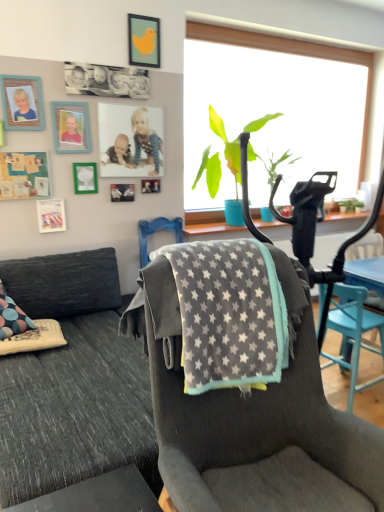
Where is `green leafy plant at center`? The height and width of the screenshot is (512, 384). green leafy plant at center is located at coordinates (227, 146).

Find the location of a particular element. metallic silver picture frame at upper left, which appears as the fifth picture frame when ordered from the bottom is located at coordinates tap(85, 178).

The width and height of the screenshot is (384, 512). What do you see at coordinates (353, 333) in the screenshot?
I see `gray fabric chair at center, arranged as the first chair when viewed from the right` at bounding box center [353, 333].

This screenshot has height=512, width=384. What do you see at coordinates (73, 381) in the screenshot?
I see `velvet gray couch at center` at bounding box center [73, 381].

At what (x,y) coordinates should I click in order to perform the action: click on green leafy plant at center. Please return your answer as a coordinate pair (x, y). This screenshot has height=512, width=384. Looking at the image, I should click on (227, 146).

Considering their positions, is wooden photo frame at upper left, the 8th picture frame when ordered from top to bottom, located in front of or behind gray fleece blanket at center, the first chair when ordered from left to right?

Visually, wooden photo frame at upper left, the 8th picture frame when ordered from top to bottom, is located behind gray fleece blanket at center, the first chair when ordered from left to right.

From a real-world perspective, between wooden photo frame at upper left, which is the 2th picture frame in bottom-to-top order, and gray fleece blanket at center, placed as the 2th chair when sorted from back to front, who is vertically lower?

gray fleece blanket at center, placed as the 2th chair when sorted from back to front.

Is wooden photo frame at upper left, the 8th picture frame when ordered from top to bottom, wider than gray fleece blanket at center, which is the second chair in right-to-left order?

No.

Based on their positions, is wooden photo frame at upper left, the 8th picture frame when ordered from top to bottom, located to the left or right of gray fleece blanket at center, which is the second chair in right-to-left order?

wooden photo frame at upper left, the 8th picture frame when ordered from top to bottom, is to the left of gray fleece blanket at center, which is the second chair in right-to-left order.

Is metallic silver picture frame at upper left, positioned as the 1th picture frame in bottom-to-top order, facing towards metallic silver photo frame at center, which is the sixth picture frame from top to bottom?

No.

Which is nearer, (x=44, y=207) or (x=156, y=192)?

The point (x=44, y=207) is closer to the camera.

From a real-world perspective, is metallic silver picture frame at upper left, acting as the ninth picture frame starting from the top, above or below metallic silver photo frame at center, which is the sixth picture frame from top to bottom?

metallic silver picture frame at upper left, acting as the ninth picture frame starting from the top, is situated lower than metallic silver photo frame at center, which is the sixth picture frame from top to bottom, in the real world.

Which is more to the left, metallic silver picture frame at upper left, positioned as the 1th picture frame in bottom-to-top order, or metallic silver photo frame at center, which is counted as the 4th picture frame, starting from the bottom?

metallic silver picture frame at upper left, positioned as the 1th picture frame in bottom-to-top order.

Which picture frame is the 7th one when counting from the right side of the wooden picture frame at upper left, the seventh picture frame when ordered from top to bottom? Please provide its 2D coordinates.

[(144, 41)]

Considering the relative sizes of wooden picture frame at upper left, the seventh picture frame when ordered from top to bottom, and yellow matte picture frame at upper center, the 9th picture frame when ordered from bottom to top, in the image provided, is wooden picture frame at upper left, the seventh picture frame when ordered from top to bottom, bigger than yellow matte picture frame at upper center, the 9th picture frame when ordered from bottom to top,?

Yes, wooden picture frame at upper left, the seventh picture frame when ordered from top to bottom, is bigger than yellow matte picture frame at upper center, the 9th picture frame when ordered from bottom to top.

How far apart are wooden picture frame at upper left, the seventh picture frame when ordered from top to bottom, and yellow matte picture frame at upper center, the 9th picture frame when ordered from bottom to top?

They are 1.10 meters apart.

Considering their positions, is wooden picture frame at upper left, the seventh picture frame when ordered from top to bottom, located in front of or behind yellow matte picture frame at upper center, arranged as the 1th picture frame when viewed from the top?

wooden picture frame at upper left, the seventh picture frame when ordered from top to bottom, is in front of yellow matte picture frame at upper center, arranged as the 1th picture frame when viewed from the top.

Between green leafy plant at center and teal wooden picture frame at upper left, positioned as the seventh picture frame in bottom-to-top order, which one has smaller size?

teal wooden picture frame at upper left, positioned as the seventh picture frame in bottom-to-top order.

From a real-world perspective, relative to teal wooden picture frame at upper left, positioned as the seventh picture frame in bottom-to-top order, is green leafy plant at center vertically above or below?

green leafy plant at center is below teal wooden picture frame at upper left, positioned as the seventh picture frame in bottom-to-top order.

From the image's perspective, is green leafy plant at center positioned above or below teal wooden picture frame at upper left, positioned as the seventh picture frame in bottom-to-top order?

green leafy plant at center is situated lower than teal wooden picture frame at upper left, positioned as the seventh picture frame in bottom-to-top order, in the image.

In terms of width, does green leafy plant at center look wider or thinner when compared to teal wooden picture frame at upper left, positioned as the seventh picture frame in bottom-to-top order?

Considering their sizes, green leafy plant at center looks broader than teal wooden picture frame at upper left, positioned as the seventh picture frame in bottom-to-top order.

Which is more to the left, velvet gray couch at center or metallic silver picture frame at upper left, marked as the 5th picture frame in a top-to-bottom arrangement?

metallic silver picture frame at upper left, marked as the 5th picture frame in a top-to-bottom arrangement, is more to the left.

Is velvet gray couch at center smaller than metallic silver picture frame at upper left, marked as the 5th picture frame in a top-to-bottom arrangement?

Actually, velvet gray couch at center might be larger than metallic silver picture frame at upper left, marked as the 5th picture frame in a top-to-bottom arrangement.

Which point is more distant from viewer, (108, 353) or (77, 180)?

Positioned behind is point (77, 180).

Considering the relative sizes of metallic silver photo frame at center, which is the sixth picture frame from top to bottom, and green leafy plant at center in the image provided, is metallic silver photo frame at center, which is the sixth picture frame from top to bottom, wider than green leafy plant at center?

No, metallic silver photo frame at center, which is the sixth picture frame from top to bottom, is not wider than green leafy plant at center.

Between point (146, 192) and point (267, 114), which one is positioned behind?

Point (267, 114)

Can you confirm if metallic silver photo frame at center, which is the sixth picture frame from top to bottom, is bigger than green leafy plant at center?

Incorrect, metallic silver photo frame at center, which is the sixth picture frame from top to bottom, is not larger than green leafy plant at center.

How many degrees apart are the facing directions of metallic silver photo frame at center, which is the sixth picture frame from top to bottom, and green leafy plant at center?

The facing directions of metallic silver photo frame at center, which is the sixth picture frame from top to bottom, and green leafy plant at center are 0.626 degrees apart.

From the image's perspective, is yellow matte picture frame at upper center, arranged as the 1th picture frame when viewed from the top, positioned above or below teal wooden picture frame at upper left, positioned as the seventh picture frame in bottom-to-top order?

yellow matte picture frame at upper center, arranged as the 1th picture frame when viewed from the top, is above teal wooden picture frame at upper left, positioned as the seventh picture frame in bottom-to-top order.

Consider the image. In terms of height, does yellow matte picture frame at upper center, arranged as the 1th picture frame when viewed from the top, look taller or shorter compared to teal wooden picture frame at upper left, positioned as the seventh picture frame in bottom-to-top order?

Clearly, yellow matte picture frame at upper center, arranged as the 1th picture frame when viewed from the top, is taller compared to teal wooden picture frame at upper left, positioned as the seventh picture frame in bottom-to-top order.

Between yellow matte picture frame at upper center, arranged as the 1th picture frame when viewed from the top, and teal wooden picture frame at upper left, the third picture frame from the top, which one has larger width?

With larger width is teal wooden picture frame at upper left, the third picture frame from the top.

Is yellow matte picture frame at upper center, arranged as the 1th picture frame when viewed from the top, next to teal wooden picture frame at upper left, the third picture frame from the top?

No, yellow matte picture frame at upper center, arranged as the 1th picture frame when viewed from the top, is not beside teal wooden picture frame at upper left, the third picture frame from the top.

You are a GUI agent. You are given a task and a screenshot of the screen. Output one action in this format:
    pyautogui.click(x=<x>, y=<y>)
    Task: Click on the picture frame that is the 2nd one when counting upward from the gray fleece blanket at center, which is the second chair in right-to-left order (from the image's perspective)
    The image size is (384, 512).
    Given the screenshot: What is the action you would take?
    pyautogui.click(x=122, y=192)

From a real-world perspective, count 2nd picture frames upward from the metallic silver picture frame at upper left, positioned as the 1th picture frame in bottom-to-top order, and point to it. Please provide its 2D coordinates.

[(150, 186)]

Estimate the real-world distances between objects in this image. Which object is further from gray fleece blanket at center, yellow matte picture frame at upper center, arranged as the 1th picture frame when viewed from the top, or wooden picture frame at upper left, the third picture frame positioned from the bottom?

yellow matte picture frame at upper center, arranged as the 1th picture frame when viewed from the top, lies further to gray fleece blanket at center than the other object.

Estimate the real-world distances between objects in this image. Which object is closer to metallic silver photo frame at center, which is the sixth picture frame from top to bottom, gray fabric chair at center, which ranks as the 1th chair in back-to-front order, or metallic silver picture frame at upper left, which appears as the fifth picture frame when ordered from the bottom?

Based on the image, metallic silver picture frame at upper left, which appears as the fifth picture frame when ordered from the bottom, appears to be nearer to metallic silver photo frame at center, which is the sixth picture frame from top to bottom.

Considering their positions, is wooden photo frame at upper left, the 8th picture frame when ordered from top to bottom, positioned further to wooden photo frame at upper left, placed as the second picture frame when sorted from top to bottom, than metallic silver photo frame at center, which is the sixth picture frame from top to bottom?

metallic silver photo frame at center, which is the sixth picture frame from top to bottom, is further to wooden photo frame at upper left, placed as the second picture frame when sorted from top to bottom.

From the image, which object appears to be farther from matte plastic photo frame at upper center, which is the fourth picture frame from top to bottom, gray fabric chair at center, which ranks as the 2th chair in left-to-right order, or gray fleece blanket at center, which is the second chair in right-to-left order?

gray fleece blanket at center, which is the second chair in right-to-left order, lies further to matte plastic photo frame at upper center, which is the fourth picture frame from top to bottom, than the other object.

Estimate the real-world distances between objects in this image. Which object is further from wooden photo frame at upper left, placed as the eighth picture frame when sorted from bottom to top, gray fleece blanket at center or gray fleece blanket at center, placed as the 2th chair when sorted from back to front?

gray fleece blanket at center, placed as the 2th chair when sorted from back to front.

From the image, which object appears to be farther from gray fleece blanket at center, gray fleece blanket at center, placed as the first chair when sorted from front to back, or gray fabric chair at center, which ranks as the 1th chair in back-to-front order?

The object further to gray fleece blanket at center is gray fabric chair at center, which ranks as the 1th chair in back-to-front order.

From the image, which object appears to be farther from metallic silver picture frame at upper left, marked as the 5th picture frame in a top-to-bottom arrangement, matte plastic photo frame at upper center, which is the fourth picture frame from top to bottom, or gray fleece blanket at center?

Based on the image, gray fleece blanket at center appears to be further to metallic silver picture frame at upper left, marked as the 5th picture frame in a top-to-bottom arrangement.

Considering their positions, is wooden picture frame at upper left, the seventh picture frame when ordered from top to bottom, positioned further to green leafy plant at center than metallic silver picture frame at upper left, acting as the ninth picture frame starting from the top?

Among the two, wooden picture frame at upper left, the seventh picture frame when ordered from top to bottom, is located further to green leafy plant at center.

Where is `picture frame between gray fleece blanket at center, placed as the 2th chair when sorted from back to front, and wooden picture frame at upper left, the third picture frame positioned from the bottom, in the front-back direction`? The image size is (384, 512). picture frame between gray fleece blanket at center, placed as the 2th chair when sorted from back to front, and wooden picture frame at upper left, the third picture frame positioned from the bottom, in the front-back direction is located at coordinates (22, 102).

The height and width of the screenshot is (512, 384). Find the location of `chair between velvet gray couch at center and wooden photo frame at upper left, which is the 2th picture frame in bottom-to-top order, from front to back`. chair between velvet gray couch at center and wooden photo frame at upper left, which is the 2th picture frame in bottom-to-top order, from front to back is located at coordinates (353, 333).

This screenshot has height=512, width=384. Identify the location of blanket positioned between velvet gray couch at center and metallic silver picture frame at upper left, which appears as the fifth picture frame when ordered from the bottom, from near to far. (229, 314).

Find the location of a particular element. Image resolution: width=384 pixels, height=512 pixels. blanket located between wooden photo frame at upper left, placed as the second picture frame when sorted from top to bottom, and gray fabric chair at center, which ranks as the 1th chair in back-to-front order, in the left-right direction is located at coordinates (229, 314).